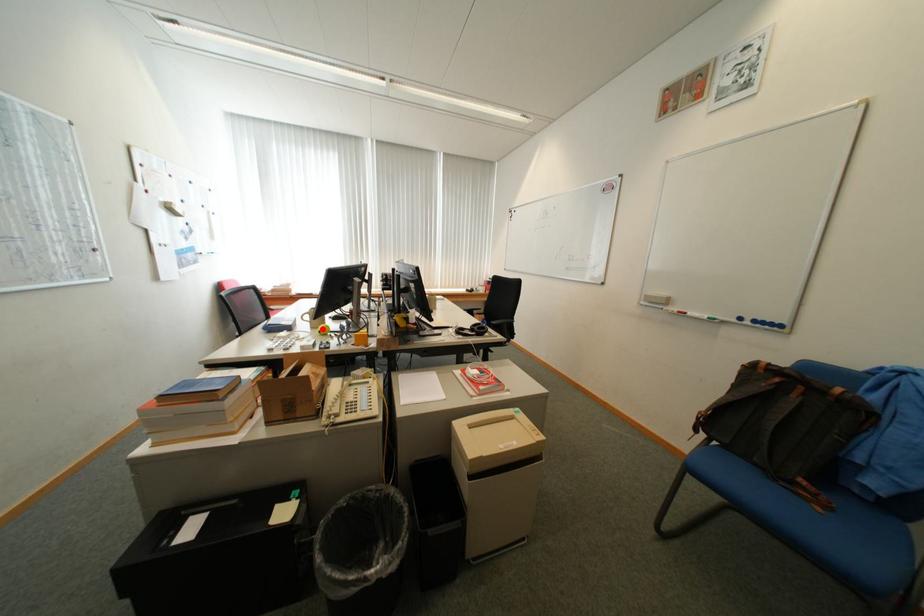
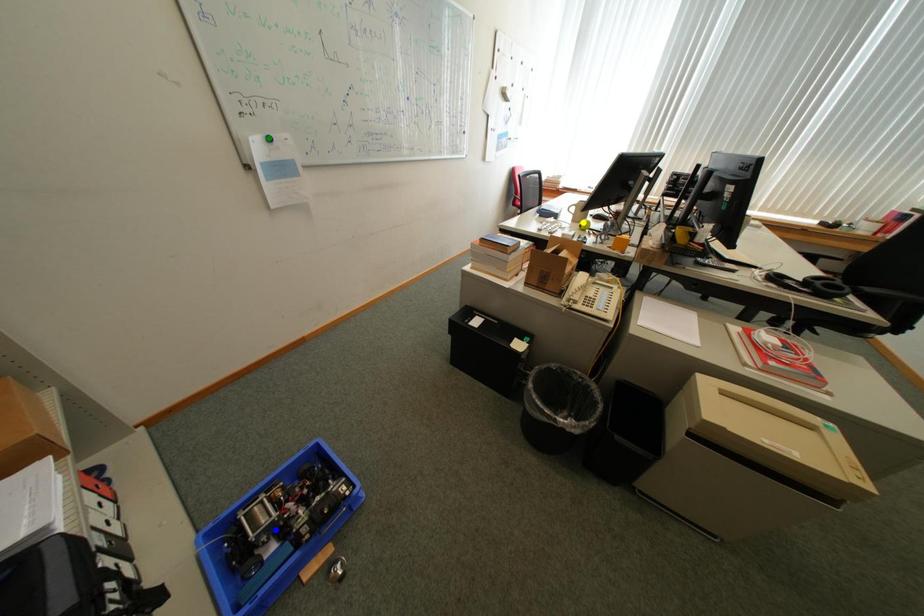
Question: I am providing you with two images of the same scene from different viewpoints. A red point is marked on the first image. You are given multiple points on the second image. Can you choose the point in image 2 that corresponds to the point in image 1?

Choices:
 (A) blue point
 (B) green point
 (C) yellow point

Answer: (C)